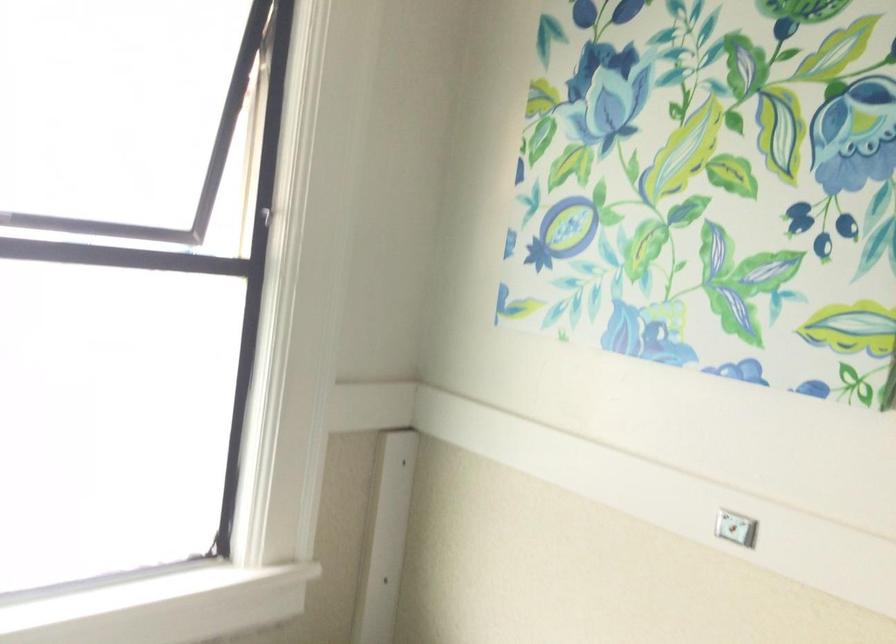
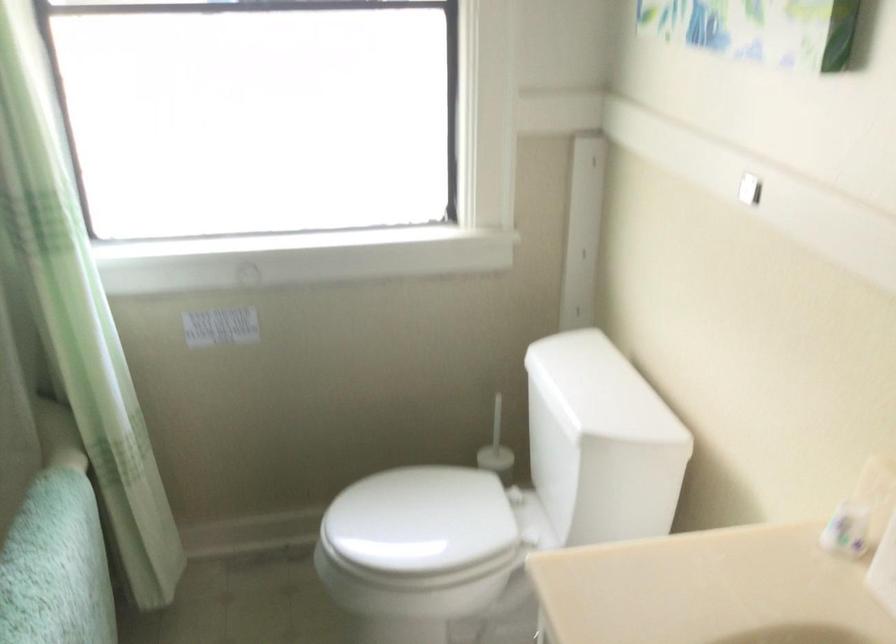
Consider the image. First-person continuous shooting, in which direction is the camera rotating?

The rotation direction of the camera is left-down.